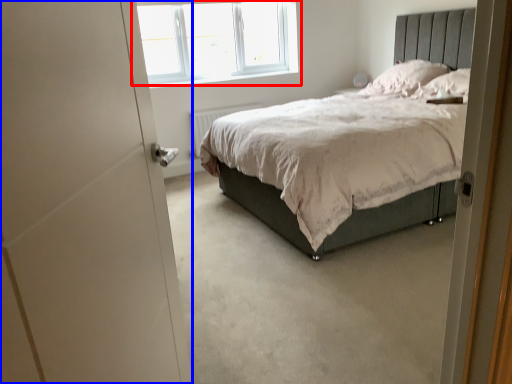
Question: Which object appears farthest to the camera in this image, window (highlighted by a red box) or screen door (highlighted by a blue box)?

Choices:
 (A) window
 (B) screen door

Answer: (A)